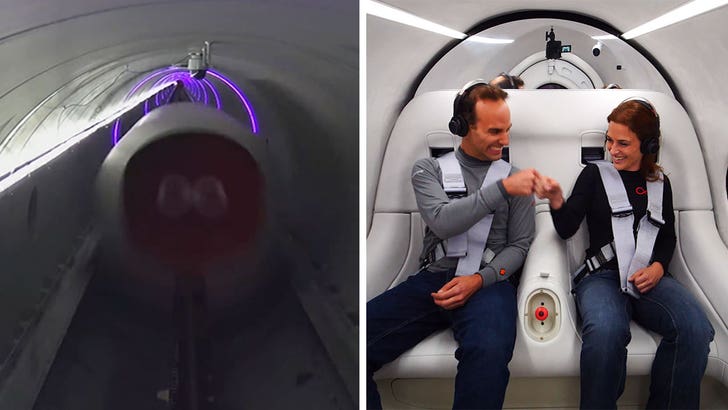
This screenshot has height=410, width=728. Find the location of `headset`. headset is located at coordinates (467, 105).